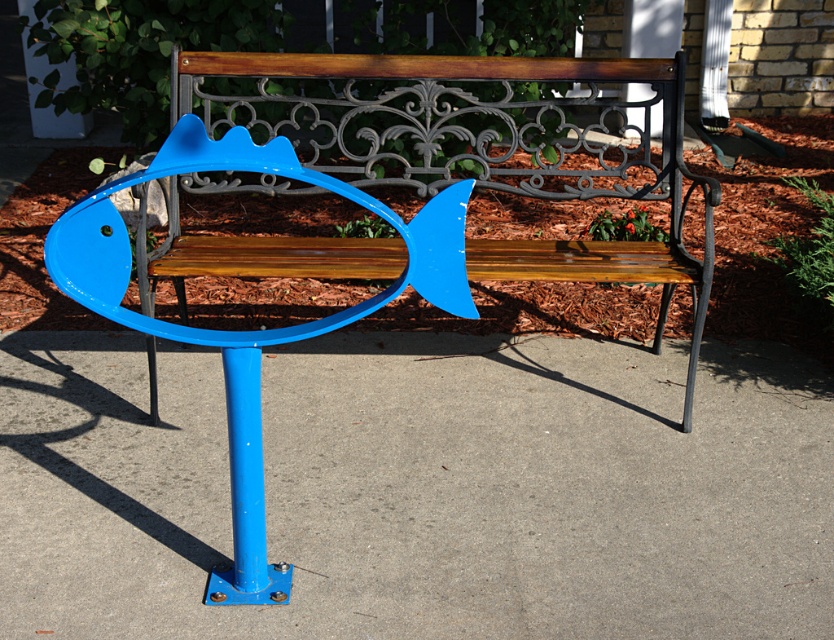
You are a painter who needs to touch up the blue metal pole at center and the blue painted metal fish at center. Since you can only carry one ladder at a time, which object should you paint first if you want to minimize moving the ladder?

You should paint the blue metal pole at center first because it is to the left of the blue painted metal fish at center, so moving from left to right would require less ladder movement.

From the picture: You are standing in front of the bench and want to place a small potted plant exactly at the point marked by the coordinates point (421, 488). Based on the scene description, what object is located at this point?

The point (421, 488) marks the location of the blue metal pole at center.